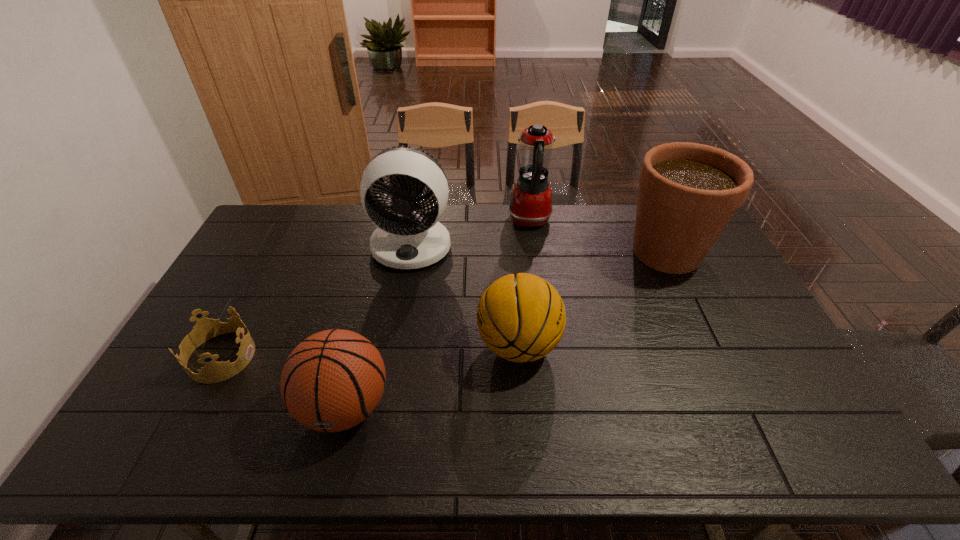
Image resolution: width=960 pixels, height=540 pixels. I want to click on blank space located on the grille of the fan, so click(391, 365).

Locate an element on the screen. Image resolution: width=960 pixels, height=540 pixels. free location located 0.200m on the left of the rightmost object is located at coordinates (564, 252).

The image size is (960, 540). Identify the location of vacant region located on the surface of the right basketball near the brand logo. (349, 345).

You are a GUI agent. You are given a task and a screenshot of the screen. Output one action in this format:
    pyautogui.click(x=<x>, y=<y>)
    Task: Click on the free space located 0.230m on the surface of the right basketball near the brand logo
    This screenshot has width=960, height=540.
    Given the screenshot: What is the action you would take?
    pyautogui.click(x=396, y=345)

Locate an element on the screen. Image resolution: width=960 pixels, height=540 pixels. free location located 0.300m on the surface of the right basketball near the brand logo is located at coordinates (371, 345).

Find the location of a particular element. The image size is (960, 540). vacant region located on the front-facing side of the tiara is located at coordinates (376, 356).

This screenshot has width=960, height=540. What are the coordinates of `food processor at the far edge` in the screenshot? It's located at (530, 205).

I want to click on fan that is positioned at the far edge, so click(413, 239).

The height and width of the screenshot is (540, 960). Find the location of `flowerpot that is at the far edge`. flowerpot that is at the far edge is located at coordinates (688, 192).

Where is `object situated at the near edge`? object situated at the near edge is located at coordinates (333, 380).